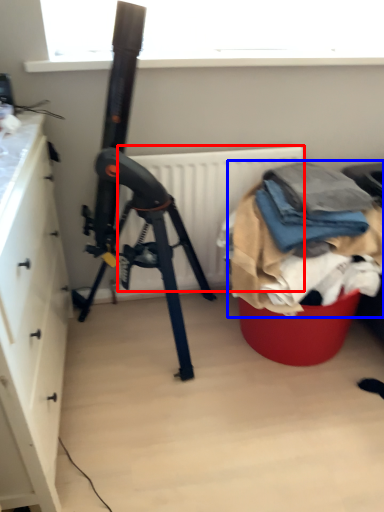
Question: Which of the following is the farthest to the observer, radiator (highlighted by a red box) or waste (highlighted by a blue box)?

Choices:
 (A) radiator
 (B) waste

Answer: (A)